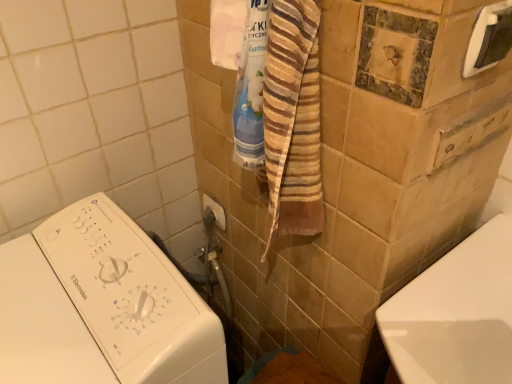
Question: From the image's perspective, is metallic silver towel bar at upper center, the first towel bar in the back-to-front sequence, above or below white plastic towel bar at upper right, the 2th towel bar positioned from the back?

Choices:
 (A) below
 (B) above

Answer: (A)

Question: In terms of height, does metallic silver towel bar at upper center, the first towel bar in the back-to-front sequence, look taller or shorter compared to white plastic towel bar at upper right, the 2th towel bar positioned from the back?

Choices:
 (A) short
 (B) tall

Answer: (A)

Question: Which object is positioned farthest from the white plastic towel bar at upper right, the 1th towel bar when ordered from top to bottom?

Choices:
 (A) white plastic washing machine at left
 (B) metallic silver towel bar at upper center, which is counted as the 2th towel bar, starting from the front

Answer: (B)

Question: Based on their relative distances, which object is nearer to the white plastic washing machine at left?

Choices:
 (A) white plastic towel bar at upper right, which is the second towel bar in left-to-right order
 (B) metallic silver towel bar at upper center, positioned as the 2th towel bar in top-to-bottom order

Answer: (B)